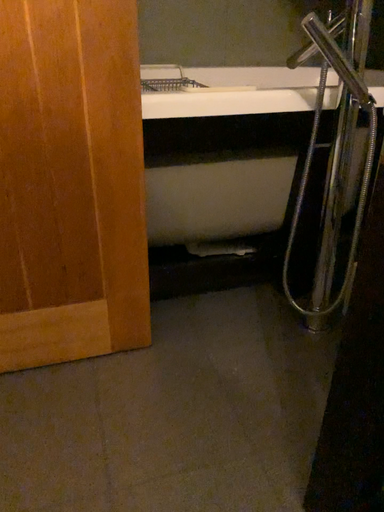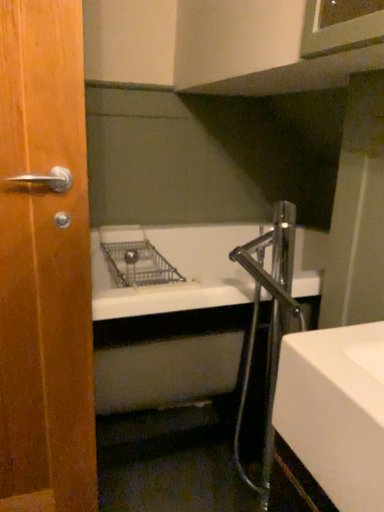
Question: How did the camera likely rotate when shooting the video?

Choices:
 (A) rotated upward
 (B) rotated downward

Answer: (A)